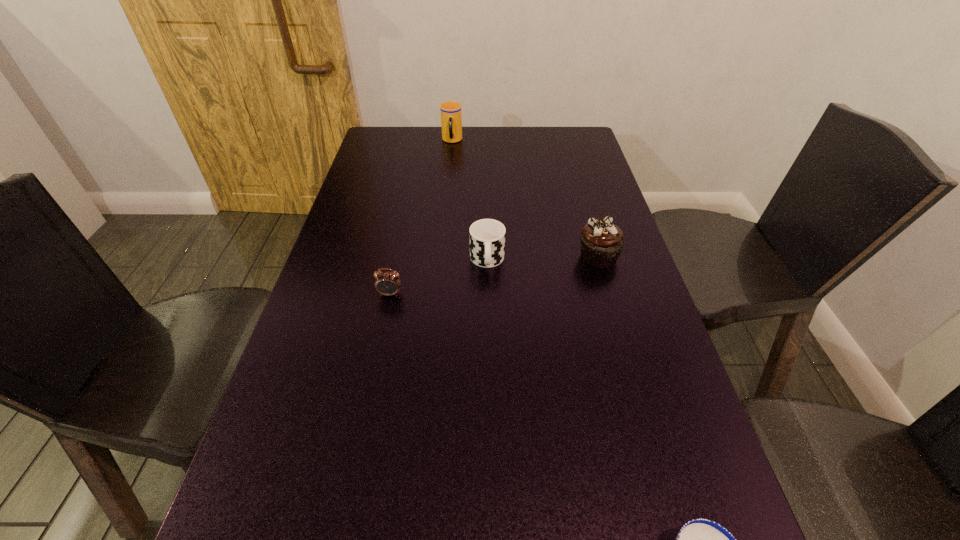
Identify the location of free spot between the farthest object and the third object from left to right. Image resolution: width=960 pixels, height=540 pixels. (469, 201).

Select which object is the second closest to the leftmost object. Please provide its 2D coordinates. Your answer should be formatted as a tuple, i.e. [(x, y)], where the tuple contains the x and y coordinates of a point satisfying the conditions above.

[(602, 242)]

Locate which object is the fourth closest to the cupcake. Please provide its 2D coordinates. Your answer should be formatted as a tuple, i.e. [(x, y)], where the tuple contains the x and y coordinates of a point satisfying the conditions above.

[(451, 111)]

Identify which cup is the nearest to the shortest cup. Please provide its 2D coordinates. Your answer should be formatted as a tuple, i.e. [(x, y)], where the tuple contains the x and y coordinates of a point satisfying the conditions above.

[(487, 236)]

The image size is (960, 540). Identify the location of cup that is the nearest to the alarm clock. (487, 236).

Locate an element on the screen. Image resolution: width=960 pixels, height=540 pixels. vacant position in the image that satisfies the following two spatial constraints: 1. on the side of the cupcake with the handle; 2. on the right side of the farthest object is located at coordinates (441, 256).